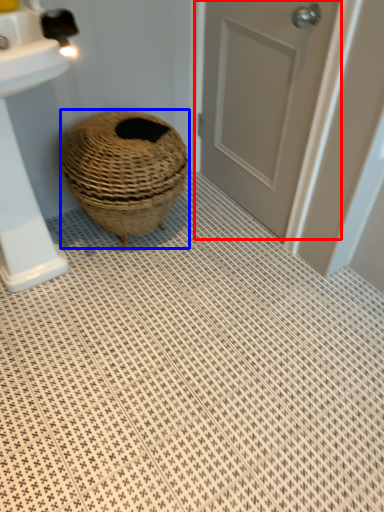
Question: Which of the following is the farthest to the observer, door (highlighted by a red box) or basket (highlighted by a blue box)?

Choices:
 (A) door
 (B) basket

Answer: (B)